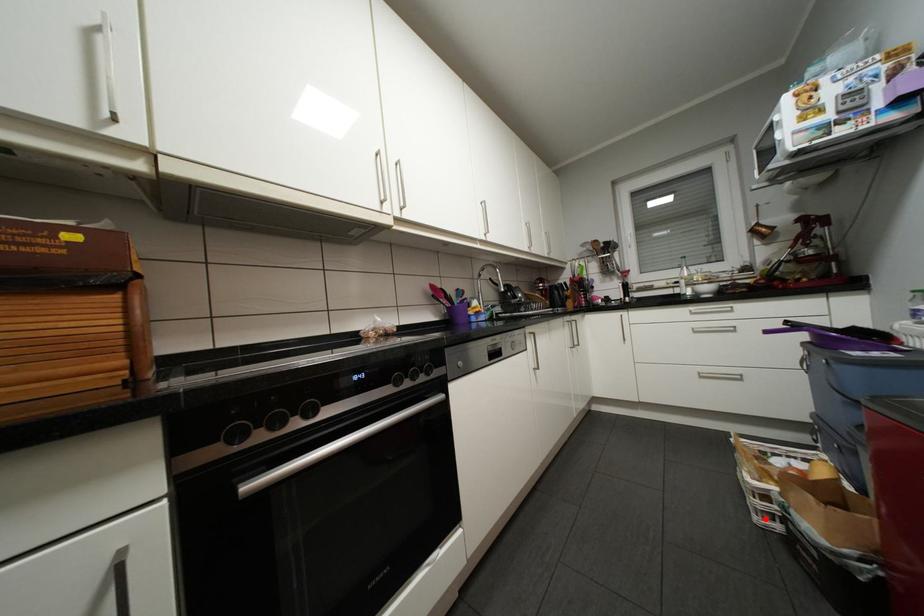
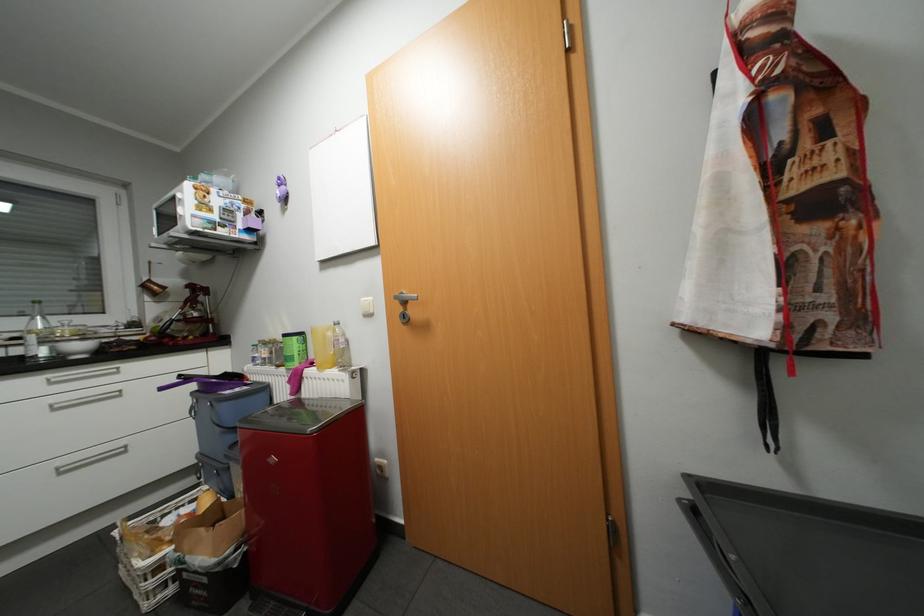
Locate, in the second image, the point that corresponds to the highlighted location in the first image.

(156, 604)